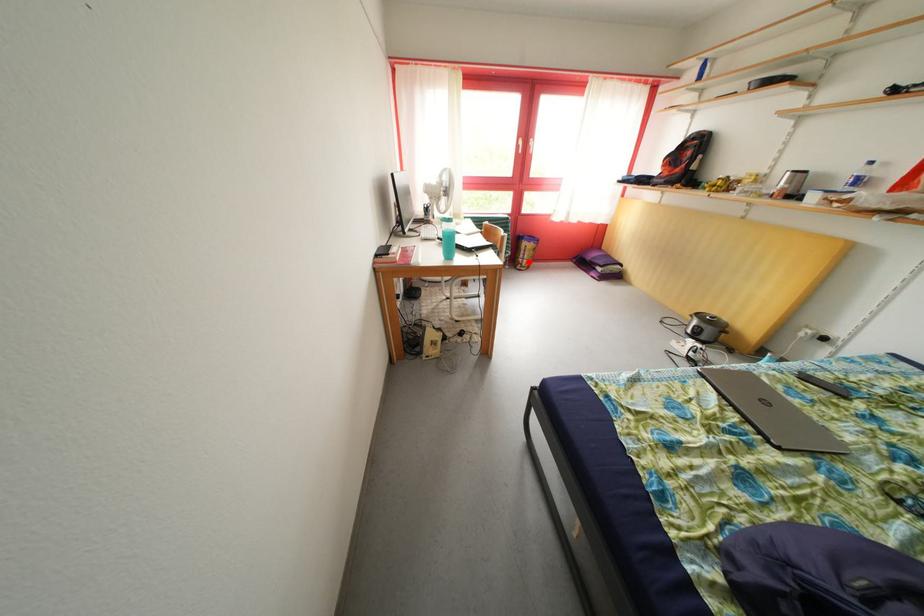
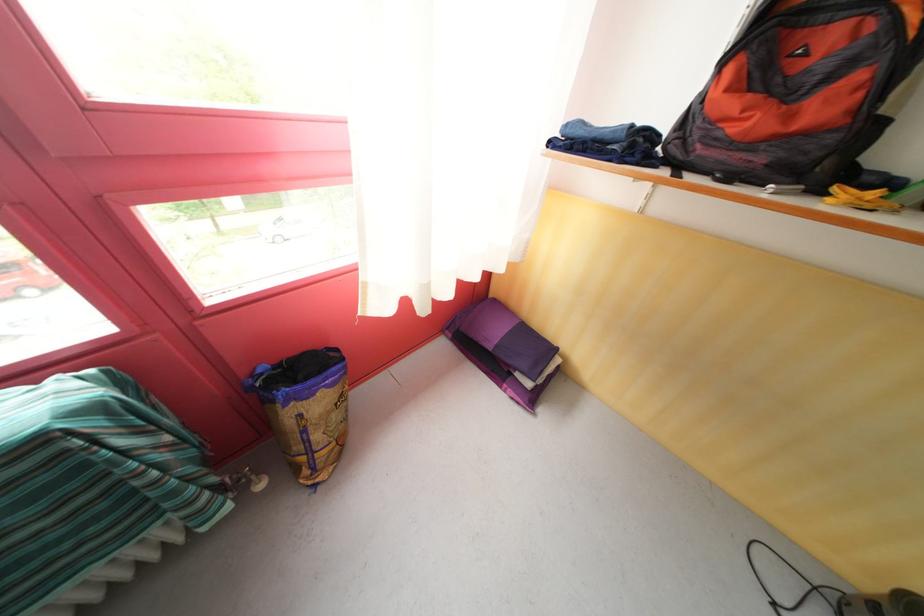
The point at the highlighted location is marked in the first image. Where is the corresponding point in the second image?

(305, 454)